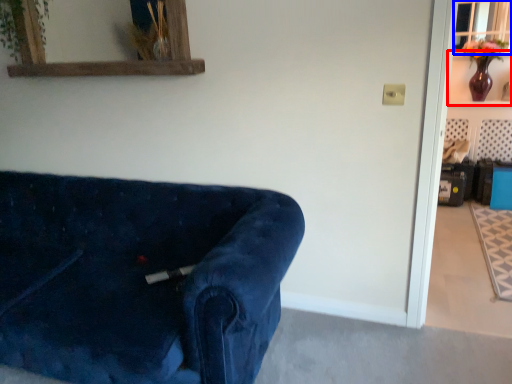
Question: Among these objects, which one is nearest to the camera, shelf (highlighted by a red box) or window (highlighted by a blue box)?

Choices:
 (A) shelf
 (B) window

Answer: (A)